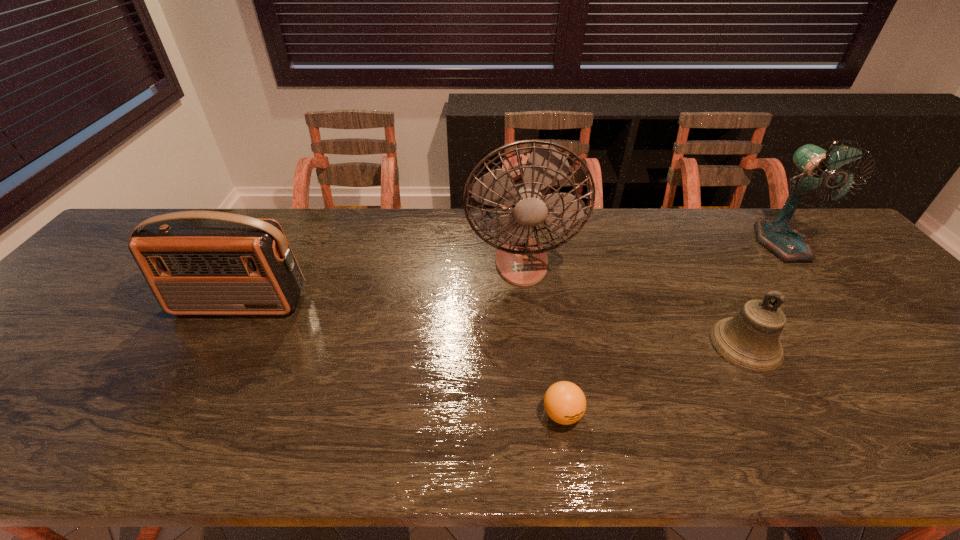
Where is `the third closest object relative to the shortest object`? The width and height of the screenshot is (960, 540). the third closest object relative to the shortest object is located at coordinates (195, 262).

Locate an element on the screen. This screenshot has height=540, width=960. object identified as the fourth closest to the second shortest object is located at coordinates (195, 262).

The image size is (960, 540). I want to click on blank area in the image that satisfies the following two spatial constraints: 1. on the front-facing side of the fourth object from left to right; 2. on the left side of the leftmost object, so click(217, 345).